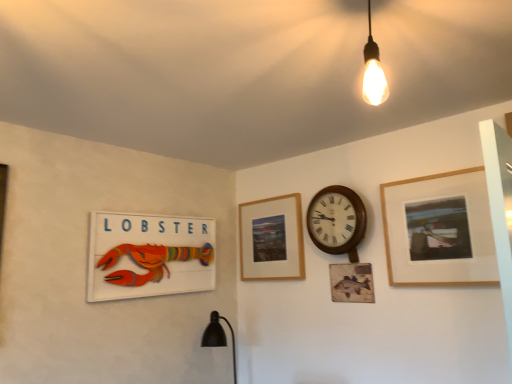
Question: Considering the relative sizes of wooden lobster sign at left, positioned as the 3th picture frame in right-to-left order, and wooden frame at upper right, marked as the third picture frame in a left-to-right arrangement, in the image provided, is wooden lobster sign at left, positioned as the 3th picture frame in right-to-left order, wider than wooden frame at upper right, marked as the third picture frame in a left-to-right arrangement,?

Choices:
 (A) no
 (B) yes

Answer: (B)

Question: From a real-world perspective, is wooden lobster sign at left, marked as the first picture frame in a left-to-right arrangement, over wooden frame at upper right, marked as the third picture frame in a left-to-right arrangement?

Choices:
 (A) no
 (B) yes

Answer: (A)

Question: Does wooden lobster sign at left, positioned as the 3th picture frame in right-to-left order, appear on the left side of wooden frame at upper right, marked as the third picture frame in a left-to-right arrangement?

Choices:
 (A) yes
 (B) no

Answer: (A)

Question: Could you tell me if wooden lobster sign at left, marked as the first picture frame in a left-to-right arrangement, is facing wooden frame at upper right, the first picture frame positioned from the right?

Choices:
 (A) no
 (B) yes

Answer: (B)

Question: Is wooden lobster sign at left, positioned as the 3th picture frame in right-to-left order, outside wooden frame at upper right, the first picture frame positioned from the right?

Choices:
 (A) yes
 (B) no

Answer: (A)

Question: Is wooden lobster sign at left, positioned as the 3th picture frame in right-to-left order, next to wooden frame at upper right, the first picture frame positioned from the right, and touching it?

Choices:
 (A) yes
 (B) no

Answer: (B)

Question: Is wooden picture frame at center, which is the second picture frame in right-to-left order, far from wooden clock at center-right?

Choices:
 (A) yes
 (B) no

Answer: (B)

Question: From a real-world perspective, is wooden picture frame at center, which is the second picture frame in right-to-left order, physically below wooden clock at center-right?

Choices:
 (A) yes
 (B) no

Answer: (A)

Question: From the image's perspective, is wooden picture frame at center, which is the second picture frame in right-to-left order, beneath wooden clock at center-right?

Choices:
 (A) yes
 (B) no

Answer: (A)

Question: Is the depth of wooden picture frame at center, which ranks as the 2th picture frame in left-to-right order, greater than that of wooden clock at center-right?

Choices:
 (A) no
 (B) yes

Answer: (B)

Question: Considering the relative sizes of wooden picture frame at center, which is the second picture frame in right-to-left order, and wooden clock at center-right in the image provided, is wooden picture frame at center, which is the second picture frame in right-to-left order, bigger than wooden clock at center-right?

Choices:
 (A) no
 (B) yes

Answer: (A)

Question: Considering the relative positions of wooden picture frame at center, which is the second picture frame in right-to-left order, and wooden clock at center-right in the image provided, is wooden picture frame at center, which is the second picture frame in right-to-left order, to the right of wooden clock at center-right from the viewer's perspective?

Choices:
 (A) no
 (B) yes

Answer: (A)

Question: Considering the relative positions of wooden picture frame at center, which ranks as the 2th picture frame in left-to-right order, and wooden lobster sign at left, marked as the first picture frame in a left-to-right arrangement, in the image provided, is wooden picture frame at center, which ranks as the 2th picture frame in left-to-right order, to the left of wooden lobster sign at left, marked as the first picture frame in a left-to-right arrangement, from the viewer's perspective?

Choices:
 (A) yes
 (B) no

Answer: (B)